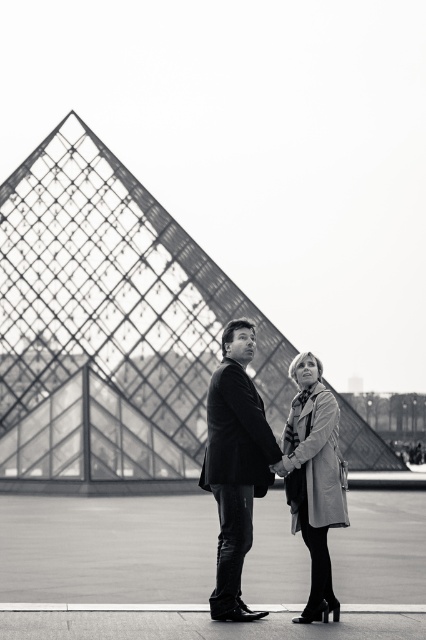
Question: Which point is closer to the camera?

Choices:
 (A) (294, 420)
 (B) (181, 465)

Answer: (A)

Question: Among these objects, which one is farthest from the camera?

Choices:
 (A) light gray wool coat at center
 (B) glass lattice pyramid at center

Answer: (B)

Question: Does glass lattice pyramid at center lie in front of matte black suit at center?

Choices:
 (A) no
 (B) yes

Answer: (A)

Question: Which point appears farthest from the camera in this image?

Choices:
 (A) (40, 289)
 (B) (310, 589)

Answer: (A)

Question: Can you confirm if glass lattice pyramid at center is smaller than light gray wool coat at center?

Choices:
 (A) no
 (B) yes

Answer: (A)

Question: Is glass lattice pyramid at center in front of light gray wool coat at center?

Choices:
 (A) yes
 (B) no

Answer: (B)